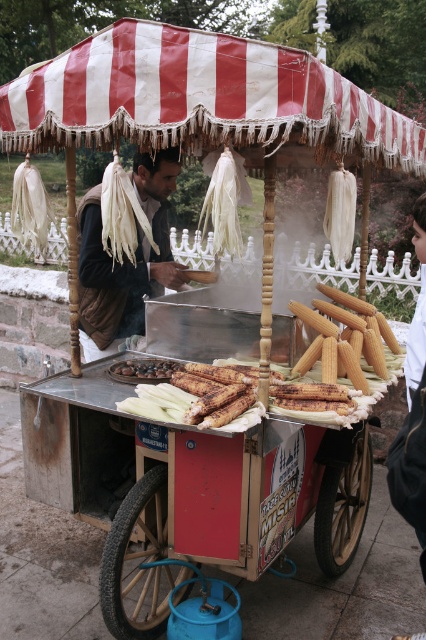
You are a customer standing in front of the street food vendor cart. You notice the red and white striped canopy at upper center and the brown leather jacket at center. Which object is nearer to you?

The red and white striped canopy at upper center is closer to the viewer than the brown leather jacket at center.

You are a customer approaching the street food vendor cart. You notice the red and white striped canopy at upper center and the brown leather jacket at center. Which object is positioned higher relative to the other?

The red and white striped canopy at upper center is located above the brown leather jacket at center.